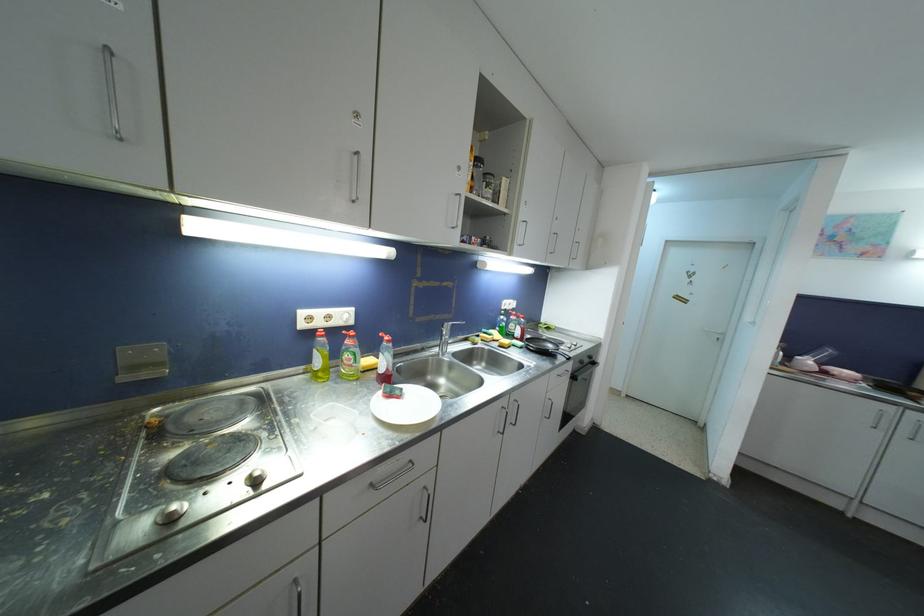
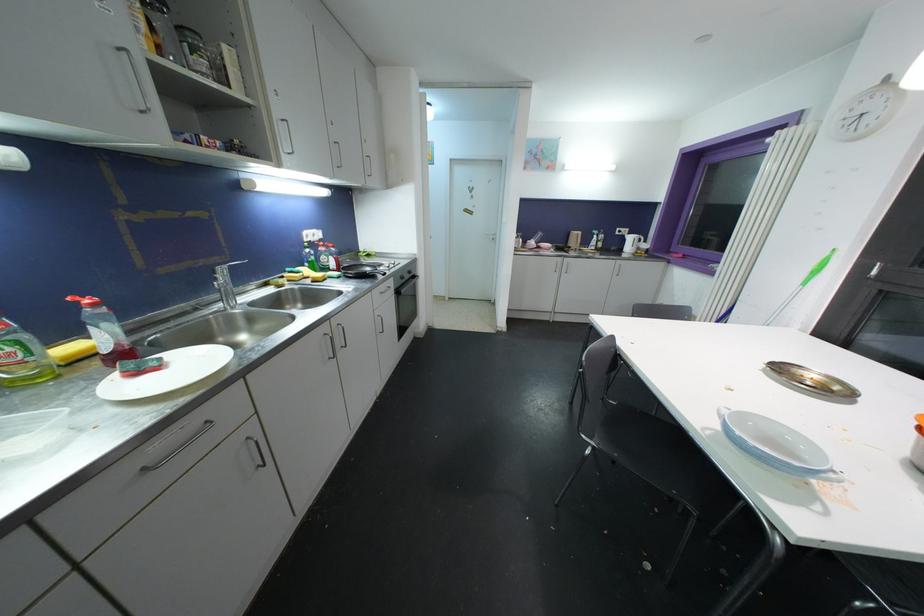
Find the pixel in the second image that matches pixel 553 349 in the first image.

(371, 272)